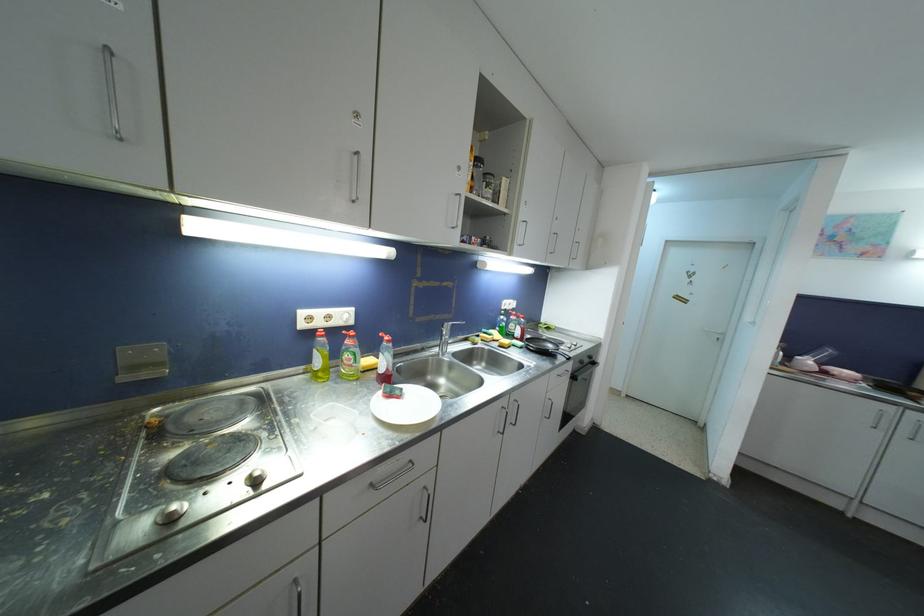
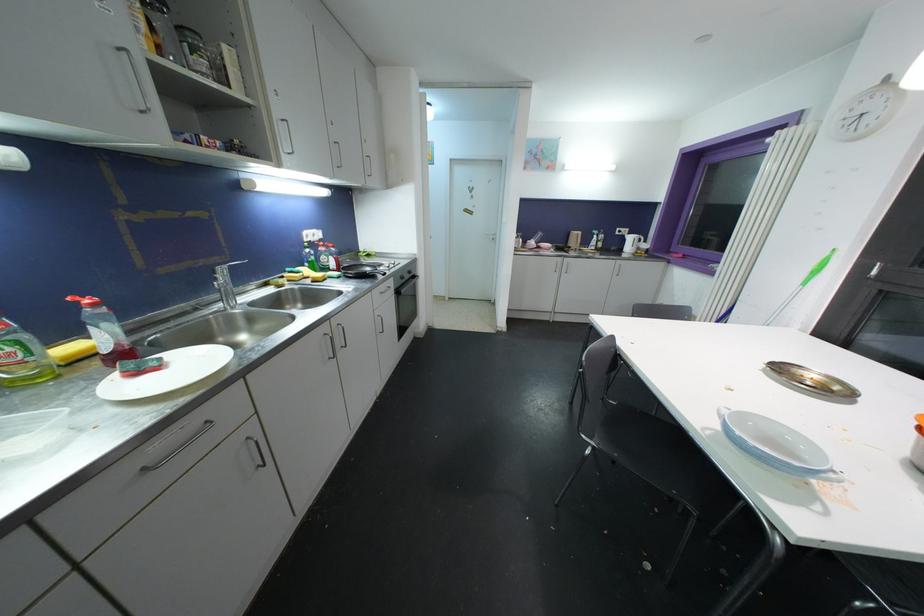
Find the pixel in the second image that matches pixel 553 349 in the first image.

(371, 272)